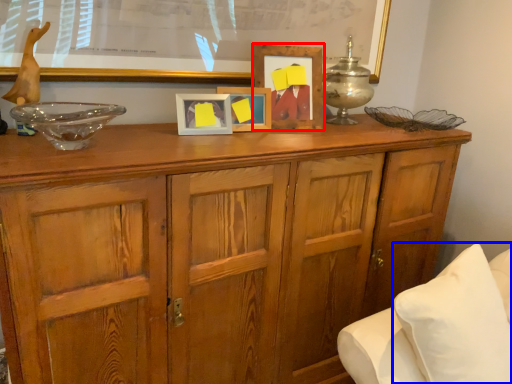
Question: Which object appears farthest to the camera in this image, picture frame (highlighted by a red box) or pillow (highlighted by a blue box)?

Choices:
 (A) picture frame
 (B) pillow

Answer: (A)